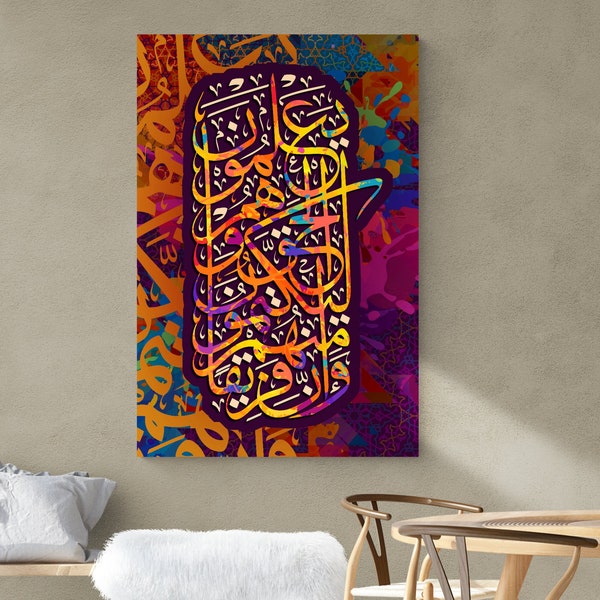
Where is `pillow`? This screenshot has height=600, width=600. pillow is located at coordinates (49, 509).